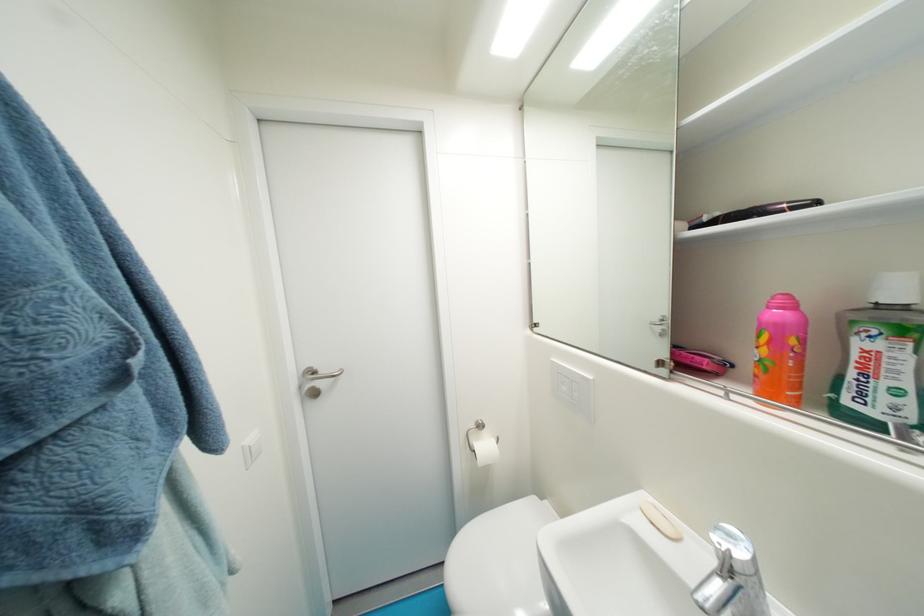
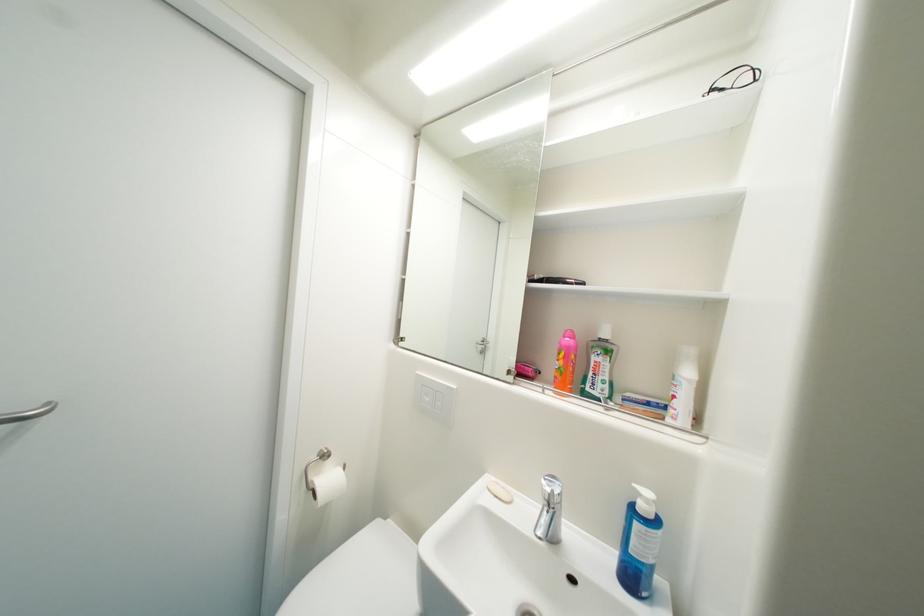
The point at (736, 553) is marked in the first image. Where is the corresponding point in the second image?

(560, 493)